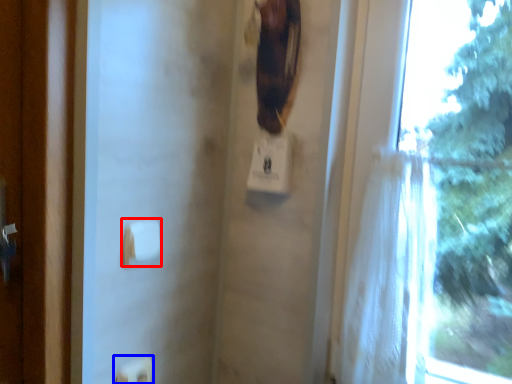
Question: Which of the following is the farthest to the observer, towel bar (highlighted by a red box) or light switch (highlighted by a blue box)?

Choices:
 (A) towel bar
 (B) light switch

Answer: (B)